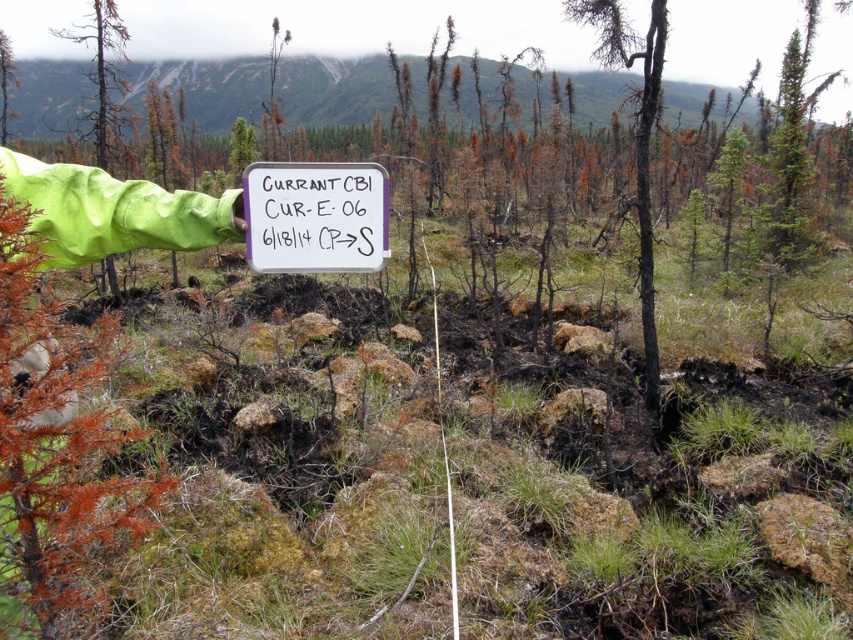
Question: Is green rubber glove at left above brown bark tree at left?

Choices:
 (A) no
 (B) yes

Answer: (B)

Question: Which point appears farthest from the camera in this image?

Choices:
 (A) (364, 230)
 (B) (0, 86)
 (C) (648, 284)
 (D) (109, 38)

Answer: (B)

Question: Among these objects, which one is nearest to the camera?

Choices:
 (A) charred bark tree at center
 (B) white paper at center
 (C) brown bark tree at left
 (D) green rubber glove at left

Answer: (B)

Question: Can you confirm if charred bark tree at center is positioned above brown bark tree at left?

Choices:
 (A) no
 (B) yes

Answer: (A)

Question: Does white paper at center come in front of brown bark tree at left?

Choices:
 (A) yes
 (B) no

Answer: (A)

Question: Estimate the real-world distances between objects in this image. Which object is closer to the green rubber glove at left?

Choices:
 (A) charred bark tree at center
 (B) brown bark tree at left
 (C) white paper at center

Answer: (B)